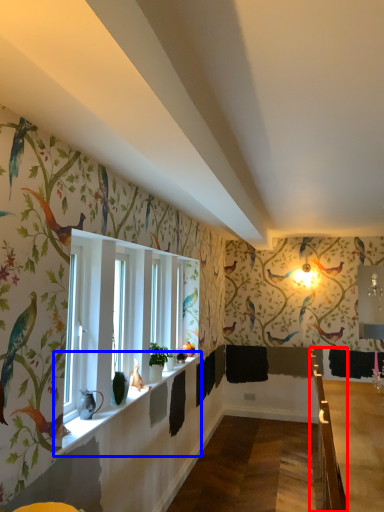
Question: Which object is further to the camera taking this photo, rail (highlighted by a red box) or window sill (highlighted by a blue box)?

Choices:
 (A) rail
 (B) window sill

Answer: (A)